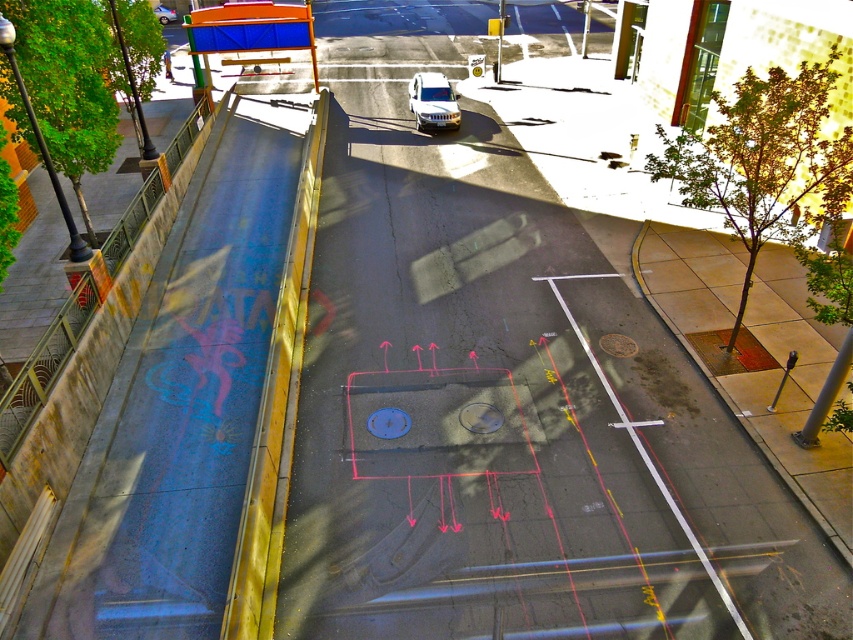
Who is taller, white matte van at center or metallic silver sedan at center?

metallic silver sedan at center is taller.

Is point (424, 115) farther from camera compared to point (154, 10)?

That is False.

This screenshot has width=853, height=640. I want to click on white matte van at center, so click(432, 100).